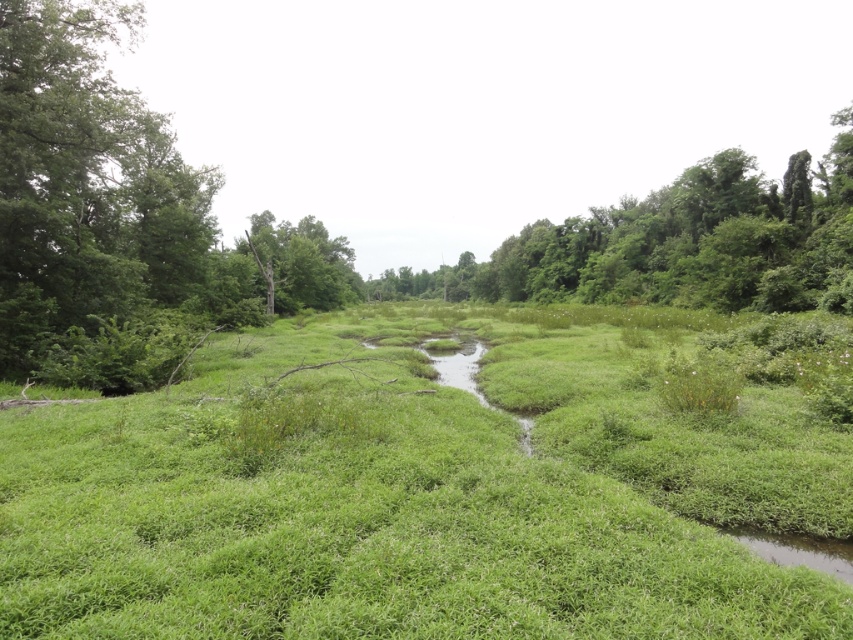
You are standing at the point marked as point (675, 604) and want to cross the stream to the opposite bank. The stream is 4.28 meters wide at this point. If you have a 4.5 meter long plank, can you safely place it across the stream to cross?

The stream is 4.28 meters wide at the point marked as point (675, 604). Since the plank is 4.5 meters long, which is slightly longer than the stream width, you can safely place it across the stream to cross.

You are a hiker trying to cross the stream. You notice the green leafy tree at upper right and the brown rough tree trunk at center. Which object is wider in terms of their size?

The green leafy tree at upper right is wider than the brown rough tree trunk at center.

You are standing at the edge of the stream and notice the green leafy tree at upper right and the brown rough tree trunk at center. Which tree is positioned more to the right side of the scene?

→ The green leafy tree at upper right is positioned to the right of the brown rough tree trunk at center, so it is more to the right side of the scene.